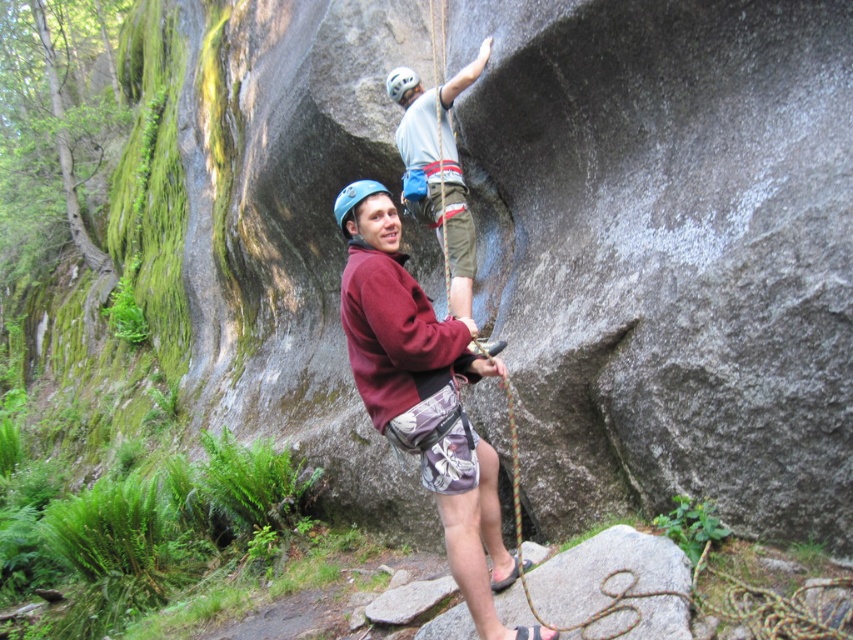
Can you confirm if matte gray helmet at upper center is wider than white matte helmet at upper center?

Yes, matte gray helmet at upper center is wider than white matte helmet at upper center.

Is matte gray helmet at upper center closer to camera compared to white matte helmet at upper center?

That is True.

Measure the distance between matte gray helmet at upper center and camera.

matte gray helmet at upper center and camera are 13.15 feet apart.

At what (x,y) coordinates should I click in order to perform the action: click on matte gray helmet at upper center. Please return your answer as a coordinate pair (x, y). This screenshot has width=853, height=640. Looking at the image, I should click on (440, 173).

Which of these two, blue matte helmet at center or white matte helmet at upper center, stands taller?

With more height is white matte helmet at upper center.

Does blue matte helmet at center have a lesser height compared to white matte helmet at upper center?

Indeed, blue matte helmet at center has a lesser height compared to white matte helmet at upper center.

Which is behind, point (345, 211) or point (416, 83)?

The point (416, 83) is behind.

I want to click on blue matte helmet at center, so click(354, 200).

From the picture: Who is more forward, (412,204) or (346,214)?

Positioned in front is point (346,214).

Is point (412, 147) farther from viewer compared to point (349, 208)?

Yes, it is behind point (349, 208).

Where is `matte gray helmet at upper center`? matte gray helmet at upper center is located at coordinates (440, 173).